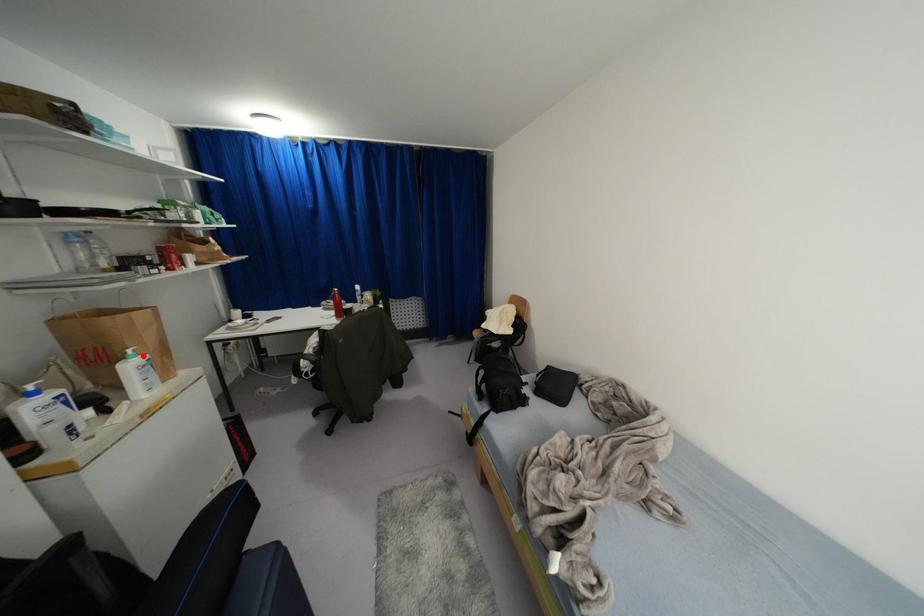
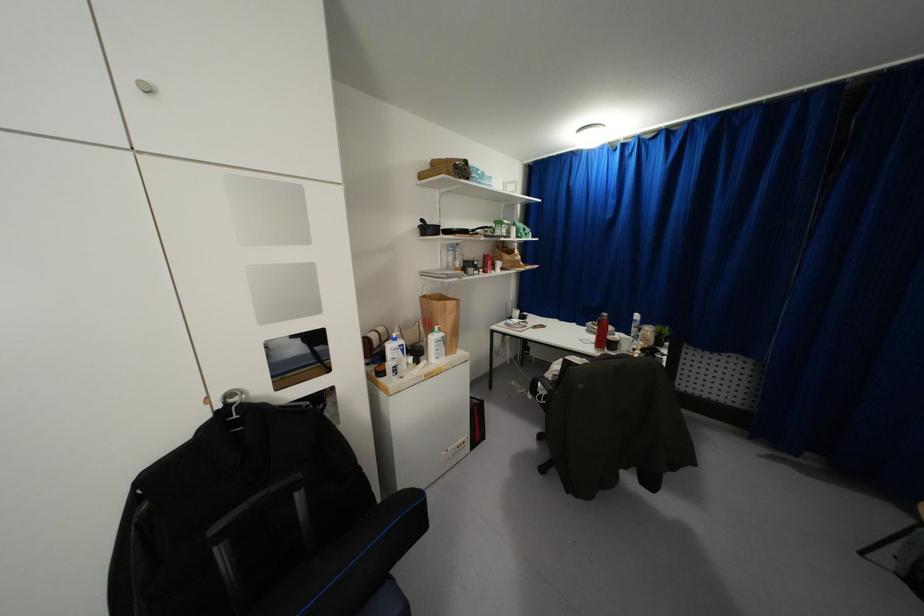
Locate, in the second image, the point that corresponds to the highlighted location in the first image.

(442, 333)